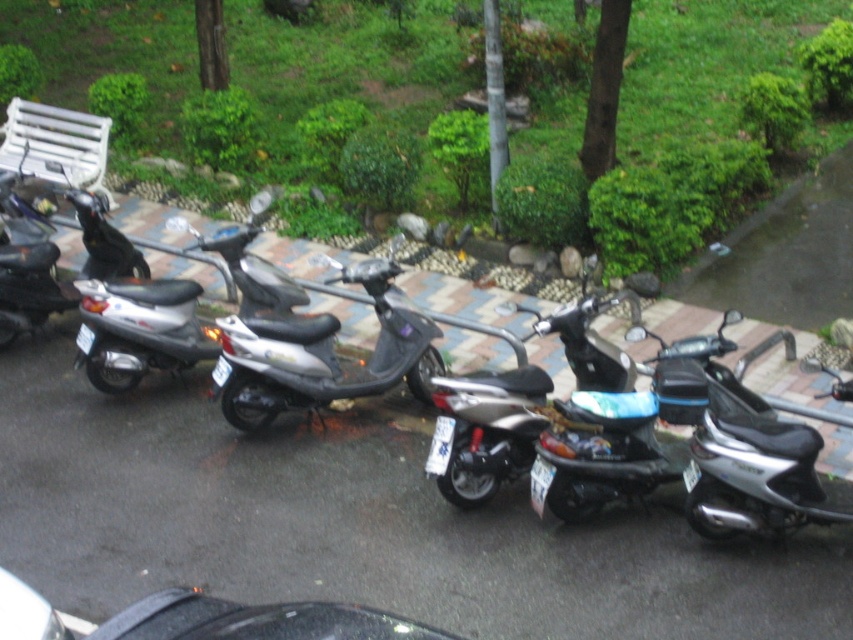
Question: Can you confirm if matte black scooter at left is wider than metallic silver scooter at center?

Choices:
 (A) no
 (B) yes

Answer: (B)

Question: Can you confirm if matte black scooter at left is smaller than silver metallic scooter at center?

Choices:
 (A) yes
 (B) no

Answer: (B)

Question: Among these points, which one is nearest to the camera?

Choices:
 (A) (456, 486)
 (B) (219, 620)
 (C) (287, 388)
 (D) (91, 40)

Answer: (B)

Question: Is matte black scooter at left positioned before silver metallic scooter at center?

Choices:
 (A) no
 (B) yes

Answer: (A)

Question: Which point is farther from the camera taking this photo?

Choices:
 (A) (274, 632)
 (B) (364, 49)
 (C) (314, 324)

Answer: (B)

Question: Among these points, which one is nearest to the camera?

Choices:
 (A) (47, 620)
 (B) (39, 134)
 (C) (4, 339)

Answer: (A)